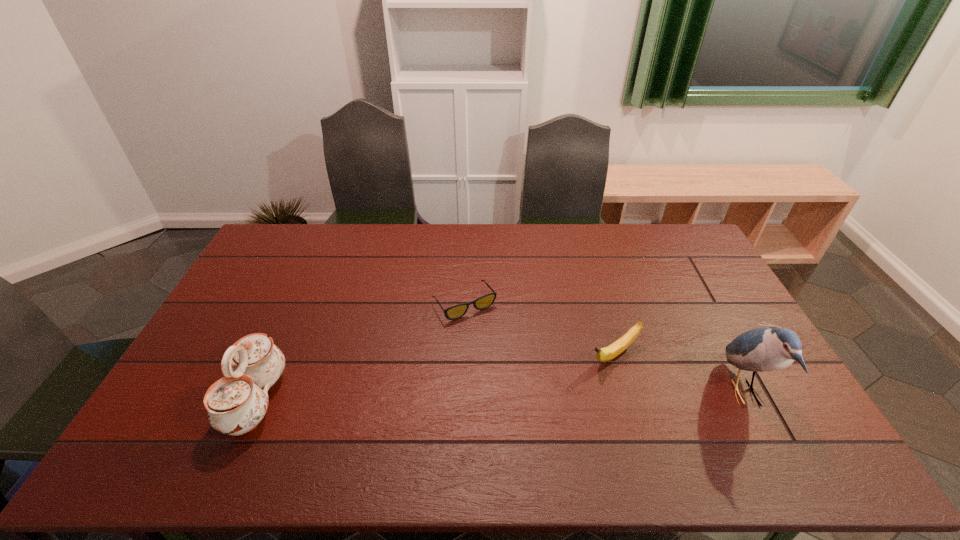
At what (x,y) coordinates should I click in order to perform the action: click on vacant space located 0.180m at the stem of the third tallest object. Please return your answer as a coordinate pair (x, y). The image size is (960, 540). Looking at the image, I should click on (548, 397).

Locate an element on the screen. This screenshot has width=960, height=540. vacant point located 0.190m at the stem of the third tallest object is located at coordinates (545, 400).

This screenshot has height=540, width=960. I want to click on vacant region located 0.340m on the front-facing side of the sunglasses, so click(538, 406).

Locate an element on the screen. This screenshot has height=540, width=960. vacant area situated on the front-facing side of the sunglasses is located at coordinates (x=541, y=411).

Locate an element on the screen. This screenshot has width=960, height=540. vacant area situated 0.150m on the front-facing side of the sunglasses is located at coordinates (502, 355).

Image resolution: width=960 pixels, height=540 pixels. Identify the location of chinaware at the near edge. (236, 403).

This screenshot has width=960, height=540. In order to click on bird situated at the near edge in this screenshot , I will do `click(767, 349)`.

The height and width of the screenshot is (540, 960). What are the coordinates of `object located at the right edge` in the screenshot? It's located at (767, 349).

Find the location of a particular element. object that is at the near right corner is located at coordinates (767, 349).

Where is `vacant area at the far edge`? Image resolution: width=960 pixels, height=540 pixels. vacant area at the far edge is located at coordinates (367, 244).